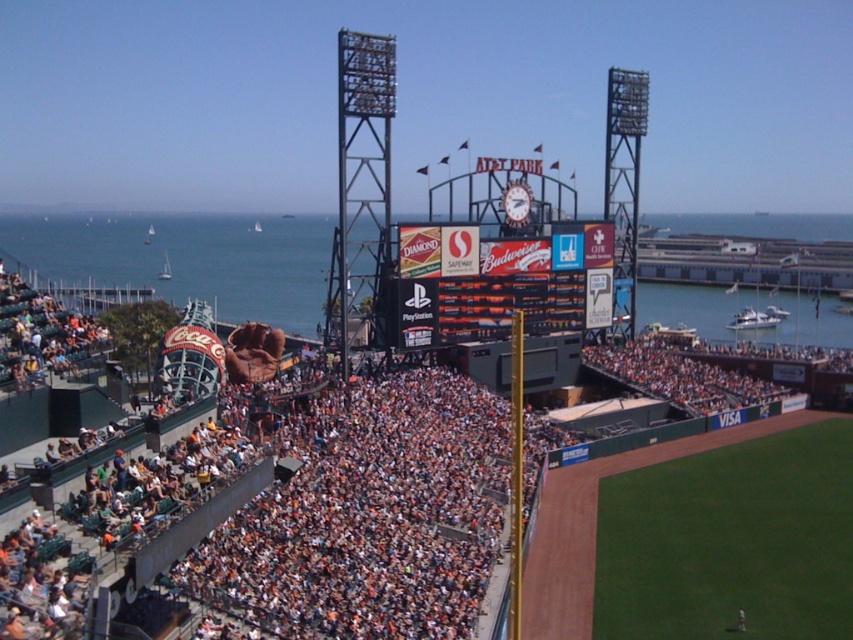
Describe the element at coordinates (189, 259) in the screenshot. Image resolution: width=853 pixels, height=640 pixels. I see `blue water at center` at that location.

Does blue water at center appear on the right side of multicolored digital display at center?

Incorrect, blue water at center is not on the right side of multicolored digital display at center.

Where is `blue water at center`? blue water at center is located at coordinates (189, 259).

Is orange fabric crowd at center positioned at the back of blue water at center?

That is False.

Which is behind, point (374, 467) or point (184, 253)?

The point (184, 253) is more distant.

Identify the location of orange fabric crowd at center. This screenshot has width=853, height=640. (369, 515).

Who is positioned more to the right, orange fabric crowd at center or multicolored digital display at center?

Positioned to the right is multicolored digital display at center.

Based on the photo, who is shorter, orange fabric crowd at center or multicolored digital display at center?

With less height is multicolored digital display at center.

What do you see at coordinates (369, 515) in the screenshot? I see `orange fabric crowd at center` at bounding box center [369, 515].

The image size is (853, 640). What are the coordinates of `orange fabric crowd at center` in the screenshot? It's located at (369, 515).